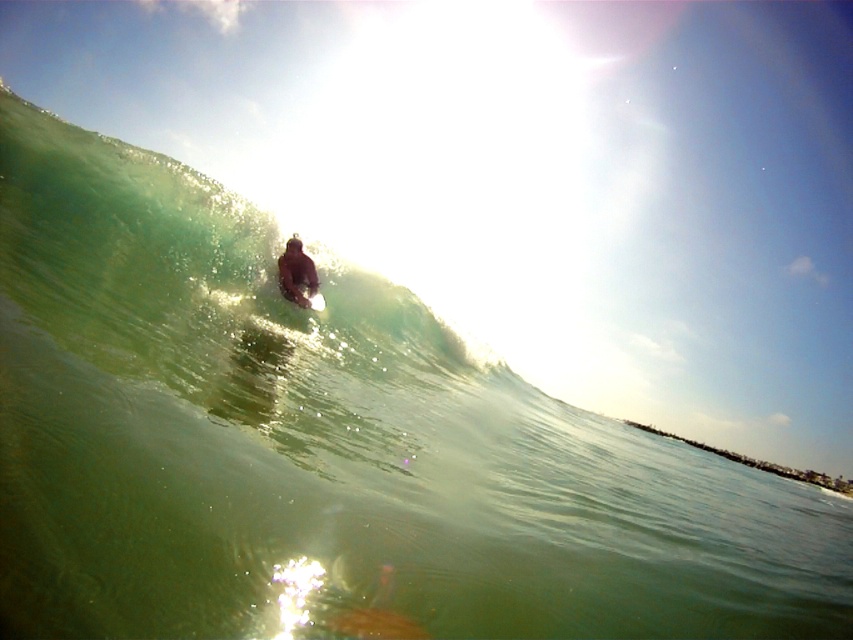
You are a photographer standing on the beach, and you want to take a clear photo of the brown wetsuit at center. However, the bright sunlight is causing glare and lens flare. What should you do to reduce the glare and capture a clear image?

Move 13.51 meters away from the brown wetsuit at center to reduce the glare and lens flare caused by the sunlight.

You are a photographer trying to capture the surfer from underwater. You notice the brown wetsuit at center and the smooth white surfboard at center. Which object appears taller in the image?

The brown wetsuit at center appears taller in the image since it has a greater height compared to the smooth white surfboard at center.

You are a photographer aiming to capture the surfer on the white foam surfboard at center. Based on the scene, where should you focus your camera to ensure the surfer is in the center of the photo?

The white foam surfboard at center is located at the 2D coordinates point (315, 301), so you should focus your camera at that point to center the surfer.